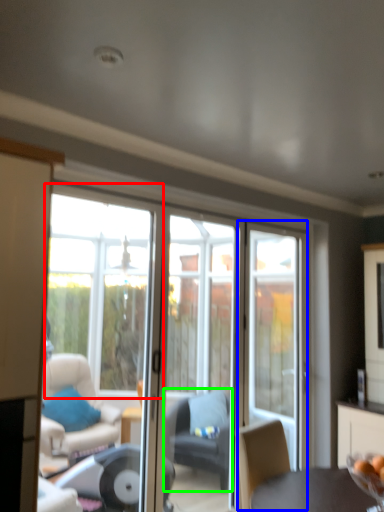
Question: Estimate the real-world distances between objects in this image. Which object is closer to window (highlighted by a red box), screen door (highlighted by a blue box) or chair (highlighted by a green box)?

Choices:
 (A) screen door
 (B) chair

Answer: (B)